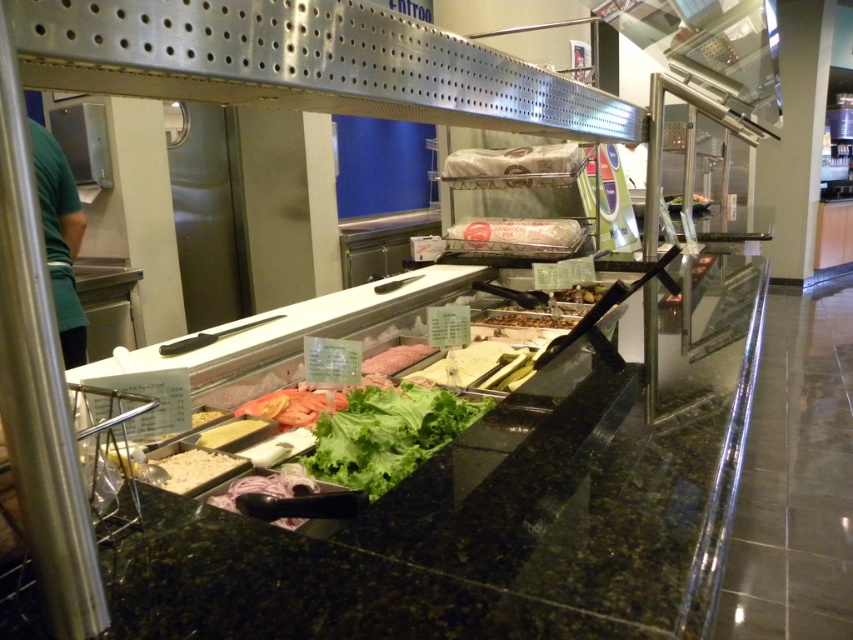
Is point (426, 445) closer to viewer compared to point (209, 410)?

Yes, it is.

Is green leafy lettuce at center taller than yellow cheese at center?

Yes.

Where is `green leafy lettuce at center`? This screenshot has width=853, height=640. green leafy lettuce at center is located at coordinates (387, 435).

Who is positioned more to the left, tomato slice at center or slightly yellowish matte cheese at center?

tomato slice at center

Which is in front, point (289, 397) or point (583, 288)?

Point (289, 397)

What do you see at coordinates (292, 406) in the screenshot? I see `tomato slice at center` at bounding box center [292, 406].

This screenshot has height=640, width=853. What are the coordinates of `tomato slice at center` in the screenshot? It's located at (292, 406).

Consider the image. Is purple translucent onions at center to the left of slightly yellowish matte cheese at center from the viewer's perspective?

Yes, purple translucent onions at center is to the left of slightly yellowish matte cheese at center.

Does point (285, 484) come behind point (567, 296)?

No, it is not.

Identify the location of purple translucent onions at center. This screenshot has width=853, height=640. (265, 484).